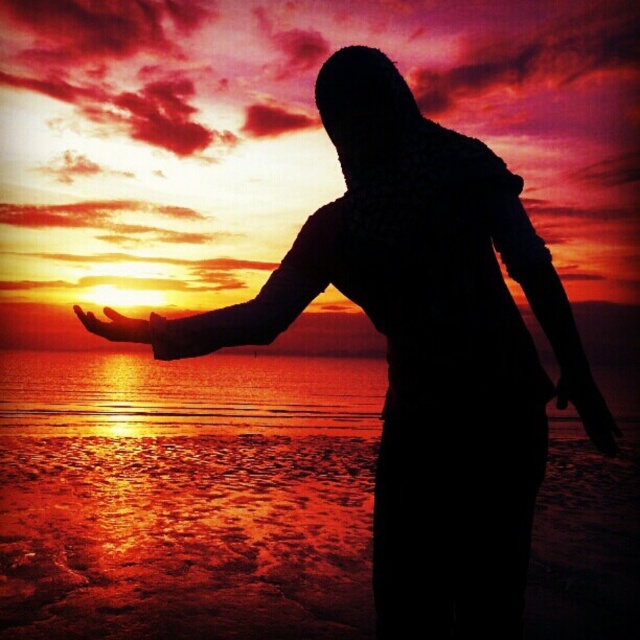
Does shiny reflective water at center appear on the left side of black matte hand at lower right?

Indeed, shiny reflective water at center is positioned on the left side of black matte hand at lower right.

Describe the element at coordinates (186, 394) in the screenshot. I see `shiny reflective water at center` at that location.

Find the location of a particular element. The image size is (640, 640). shiny reflective water at center is located at coordinates (186, 394).

Is black matte hand at lower right to the left of matte orange hand at lower left from the viewer's perspective?

No, black matte hand at lower right is not to the left of matte orange hand at lower left.

Who is positioned more to the left, black matte hand at lower right or matte orange hand at lower left?

From the viewer's perspective, matte orange hand at lower left appears more on the left side.

At what (x,y) coordinates should I click in order to perform the action: click on black matte hand at lower right. Please return your answer as a coordinate pair (x, y). The height and width of the screenshot is (640, 640). Looking at the image, I should click on (588, 404).

Is point (328, 276) closer to viewer compared to point (74, 305)?

Yes.

Can you confirm if matte black arm at center is positioned to the right of matte orange hand at lower left?

Yes, matte black arm at center is to the right of matte orange hand at lower left.

Which is in front, point (316, 291) or point (116, 317)?

Positioned in front is point (316, 291).

Where is `matte black arm at center`? The image size is (640, 640). matte black arm at center is located at coordinates (241, 301).